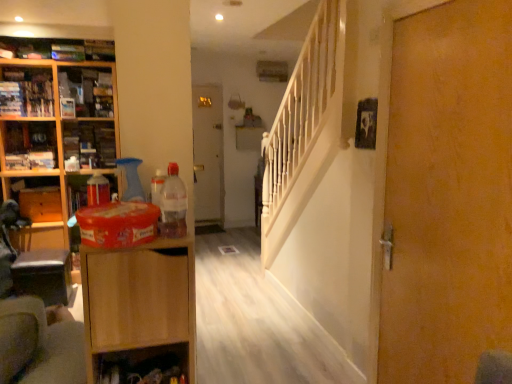
Question: From a real-world perspective, is wooden shelf at lower center positioned over translucent plastic bottle at center based on gravity?

Choices:
 (A) no
 (B) yes

Answer: (A)

Question: Does wooden shelf at lower center have a greater width compared to translucent plastic bottle at center?

Choices:
 (A) yes
 (B) no

Answer: (A)

Question: Is wooden shelf at lower center positioned far away from translucent plastic bottle at center?

Choices:
 (A) no
 (B) yes

Answer: (A)

Question: Considering the relative positions of wooden shelf at lower center and translucent plastic bottle at center in the image provided, is wooden shelf at lower center behind translucent plastic bottle at center?

Choices:
 (A) no
 (B) yes

Answer: (B)

Question: Is wooden shelf at lower center thinner than translucent plastic bottle at center?

Choices:
 (A) no
 (B) yes

Answer: (A)

Question: Is wooden shelf at lower center shorter than translucent plastic bottle at center?

Choices:
 (A) yes
 (B) no

Answer: (A)

Question: From the image's perspective, is wooden drawer at left over light brown wood cabinet at left, which is the 2th cabinetry from left to right?

Choices:
 (A) yes
 (B) no

Answer: (A)

Question: Is the surface of wooden drawer at left in direct contact with light brown wood cabinet at left, which is the 2th cabinetry from left to right?

Choices:
 (A) yes
 (B) no

Answer: (B)

Question: Is light brown wood cabinet at left, the 2th cabinetry in the back-to-front sequence, surrounded by wooden drawer at left?

Choices:
 (A) no
 (B) yes

Answer: (A)

Question: Can you confirm if wooden drawer at left is shorter than light brown wood cabinet at left, which is the 2th cabinetry from left to right?

Choices:
 (A) no
 (B) yes

Answer: (B)

Question: Is wooden drawer at left in front of light brown wood cabinet at left, the first cabinetry from the front?

Choices:
 (A) yes
 (B) no

Answer: (B)

Question: Can you confirm if wooden drawer at left is wider than light brown wood cabinet at left, the first cabinetry from the front?

Choices:
 (A) no
 (B) yes

Answer: (A)

Question: Does wooden cabinet at left, marked as the second cabinet in a left-to-right arrangement, have a lesser width compared to matte plastic container at left, positioned as the 3th cabinet in left-to-right order?

Choices:
 (A) yes
 (B) no

Answer: (B)